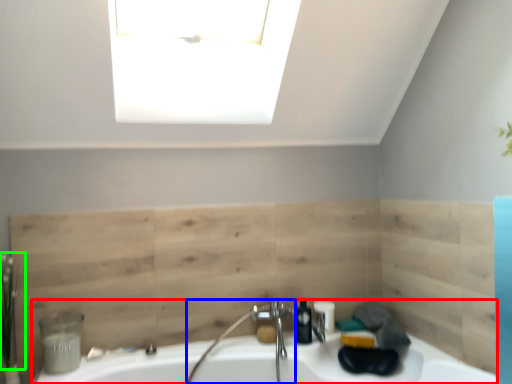
Question: Which object is positioned closest to sink (highlighted by a red box)? Select from faucet (highlighted by a blue box) and plant (highlighted by a green box).

Choices:
 (A) faucet
 (B) plant

Answer: (A)